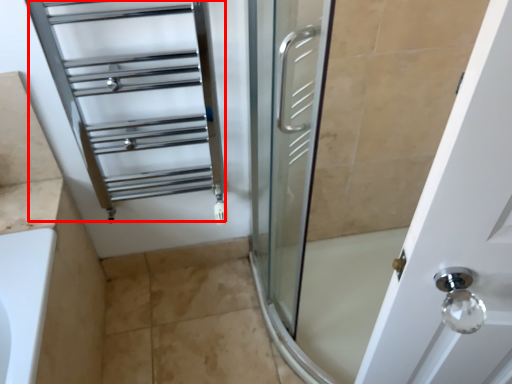
Question: From the image's perspective, where is cage (annotated by the red box) located relative to tile?

Choices:
 (A) above
 (B) below

Answer: (A)